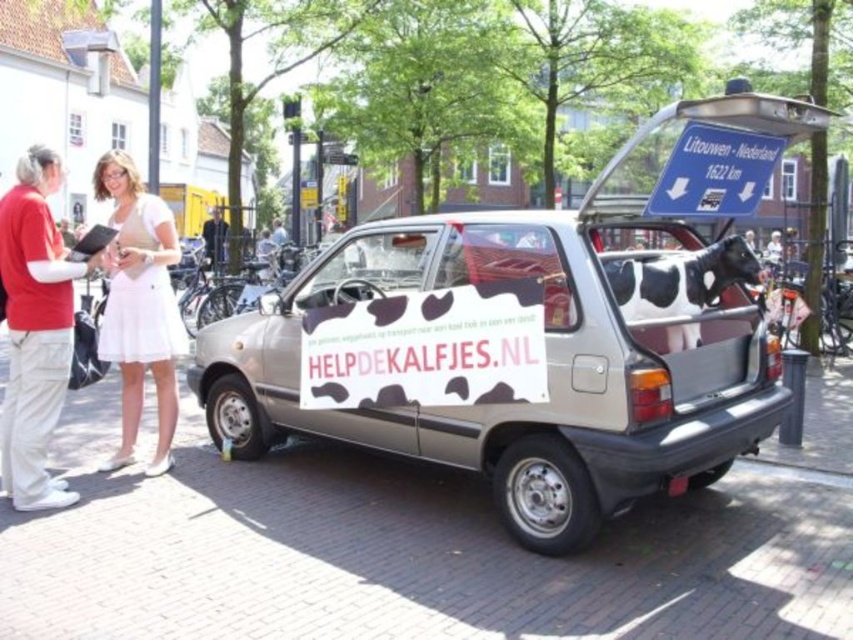
You are a delivery person who needs to deliver a package to the address located at the dark gray shirt at center. You are currently standing at the white fabric skirt at left. Can you walk straight to the address without needing to go around any obstacles?

The distance between the white fabric skirt at left and the dark gray shirt at center is 15.16 meters, so yes, you can walk straight to the address without needing to go around any obstacles as there are no mentioned obstacles in the scene description.

You are a fashion designer observing a model wearing the dark gray shirt at center and the white fabric skirt at left. Which clothing item is placed to the right side of the other?

The white fabric skirt at left is positioned on the right side of the dark gray shirt at center.

You are a fashion designer observing a model wearing a red cotton shirt at left and a white fabric skirt at left. Which clothing item is positioned more to the left side?

The red cotton shirt at left is positioned more to the left side than the white fabric skirt at left.